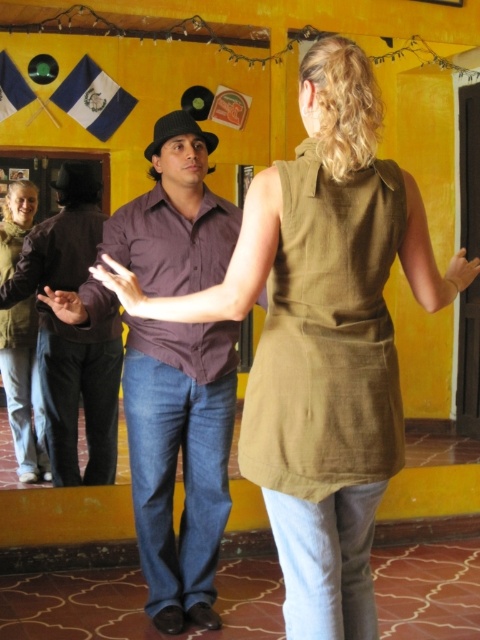
You are standing in the dance studio and want to take a photo of the two dancers. The camera can only focus on objects within a 0.02 unit range. If you focus on point 1 at point (26, 292), will it also capture point 2 at point (19, 250) clearly?

Point 1 at point (26, 292) is closer to the camera than point 2 at point (19, 250). The distance between them is 0.069 units, which is larger than the camera focus range of 0.02 units. Therefore, focusing on point 1 will not capture point 2 clearly.

In the dance studio scene, there are two people wearing purple cotton shirt at center and matte green jacket at left. From the perspective of someone standing in the middle of the room facing the entrance, which clothing item is positioned to the right?

The purple cotton shirt at center is positioned to the right of the matte green jacket at left.

In the scene shown: You are a photographer trying to capture a group photo of the dancers in the scene. You need to arrange them so that the matte brown shirt at center and the matte green jacket at left are both visible in the frame. Based on their positions, which one should be placed to the left side of the photo to ensure both are visible?

The matte green jacket at left should be placed to the left side of the photo because the matte brown shirt at center is positioned on the right side of the matte green jacket at left, so arranging them this way will maintain their original spatial relationship and ensure both are visible.